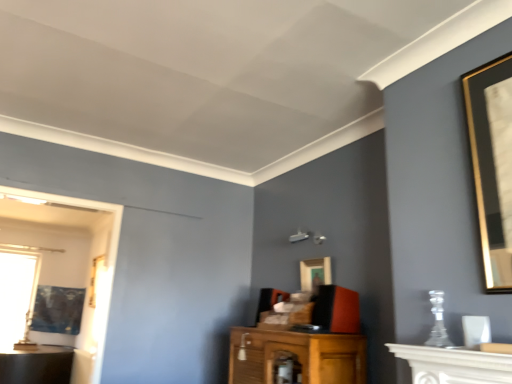
Question: From the image's perspective, is white marble fireplace at lower right on gold-framed picture at center, the 3th picture frame in the back-to-front sequence?

Choices:
 (A) yes
 (B) no

Answer: (A)

Question: Is white marble fireplace at lower right outside gold-framed picture at center, arranged as the 1th picture frame when viewed from the top?

Choices:
 (A) no
 (B) yes

Answer: (B)

Question: Is white marble fireplace at lower right surrounding gold-framed picture at center, arranged as the 1th picture frame when viewed from the top?

Choices:
 (A) no
 (B) yes

Answer: (A)

Question: Does white marble fireplace at lower right appear on the right side of gold-framed picture at center, the 3th picture frame in the bottom-to-top sequence?

Choices:
 (A) no
 (B) yes

Answer: (B)

Question: Does white marble fireplace at lower right come behind gold-framed picture at center, the 1th picture frame in the right-to-left sequence?

Choices:
 (A) no
 (B) yes

Answer: (A)

Question: From the image's perspective, is transparent glass window at left above or below gold-framed picture at left, which is the 2th picture frame from right to left?

Choices:
 (A) below
 (B) above

Answer: (A)

Question: Considering the positions of point (23, 307) and point (102, 264), is point (23, 307) closer or farther from the camera than point (102, 264)?

Choices:
 (A) farther
 (B) closer

Answer: (A)

Question: Do you think transparent glass window at left is within gold-framed picture at left, which appears as the 2th picture frame when ordered from the bottom, or outside of it?

Choices:
 (A) inside
 (B) outside

Answer: (B)

Question: In terms of width, does transparent glass window at left look wider or thinner when compared to gold-framed picture at left, the second picture frame positioned from the left?

Choices:
 (A) thin
 (B) wide

Answer: (A)

Question: From the image's perspective, is gold-framed picture at center, which ranks as the 1th picture frame in front-to-back order, above or below gold-framed picture at left, which is the 2th picture frame from right to left?

Choices:
 (A) below
 (B) above

Answer: (B)

Question: Is gold-framed picture at center, arranged as the 1th picture frame when viewed from the top, bigger or smaller than gold-framed picture at left, which appears as the second picture frame when viewed from the front?

Choices:
 (A) small
 (B) big

Answer: (A)

Question: Considering the relative positions of gold-framed picture at center, positioned as the 3th picture frame in left-to-right order, and gold-framed picture at left, which appears as the second picture frame when viewed from the front, in the image provided, is gold-framed picture at center, positioned as the 3th picture frame in left-to-right order, to the left or to the right of gold-framed picture at left, which appears as the second picture frame when viewed from the front,?

Choices:
 (A) right
 (B) left

Answer: (A)

Question: Would you say gold-framed picture at center, the 3th picture frame in the bottom-to-top sequence, is inside or outside gold-framed picture at left, the second picture frame positioned from the left?

Choices:
 (A) inside
 (B) outside

Answer: (B)

Question: Is gold-framed picture at left, the second picture frame from the top, to the left or to the right of gold-framed picture at center, the 3th picture frame in the bottom-to-top sequence, in the image?

Choices:
 (A) left
 (B) right

Answer: (A)

Question: Is gold-framed picture at left, the second picture frame from the top, in front of or behind gold-framed picture at center, the 3th picture frame in the bottom-to-top sequence, in the image?

Choices:
 (A) front
 (B) behind

Answer: (B)